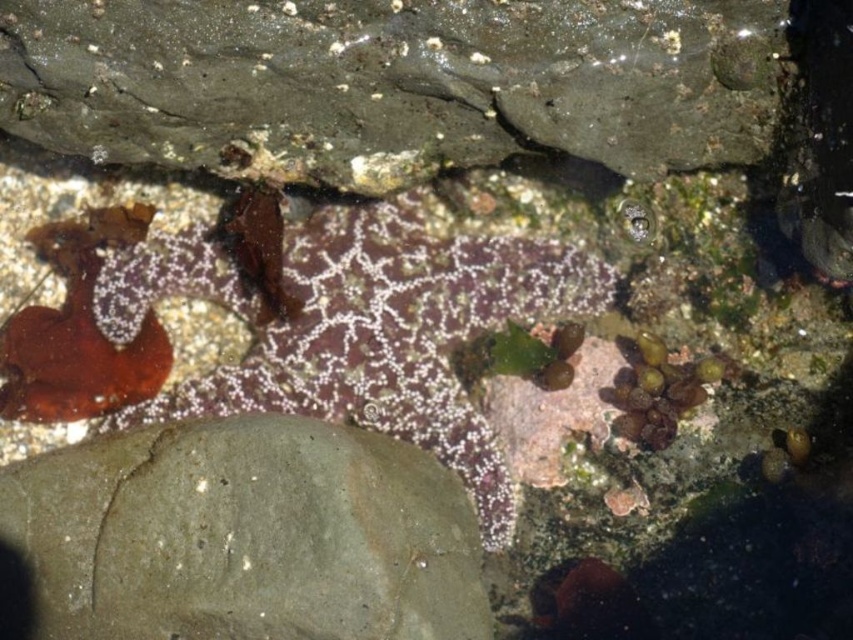
You are a marine biologist studying tide pools. You need to place a 10 cm wide measuring tool between the smooth gray rock at upper center and the gray matte rock at center. Based on their sizes, will the space between them accommodate the tool?

The smooth gray rock at upper center is wider than the gray matte rock at center. However, the exact distance between them isn

You are a marine biologist examining an underwater scene. You need to place a sensor on the smooth gray rock at upper center and another on the gray matte rock at center. Which rock should you place the sensor on first if you want to reach them in order from top to bottom?

The smooth gray rock at upper center is above the gray matte rock at center, so you should place the sensor on the smooth gray rock at upper center first as it is higher up.

You are a marine biologist observing an underwater scene. You are currently at a point 6 feet away from the camera. There is a point labeled as point (723, 106) in the image. Can you reach that point without moving your position?

The distance between point (723, 106) and the camera is 5.83 feet, which is less than your current 6 feet distance from the camera. Therefore, you can reach point (723, 106) without moving your position.